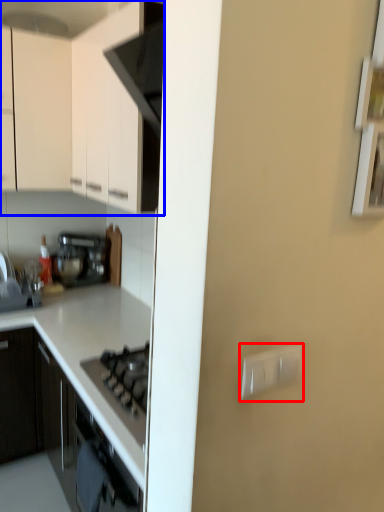
Question: Which point is further to the camera, electric outlet (highlighted by a red box) or cabinetry (highlighted by a blue box)?

Choices:
 (A) electric outlet
 (B) cabinetry

Answer: (B)